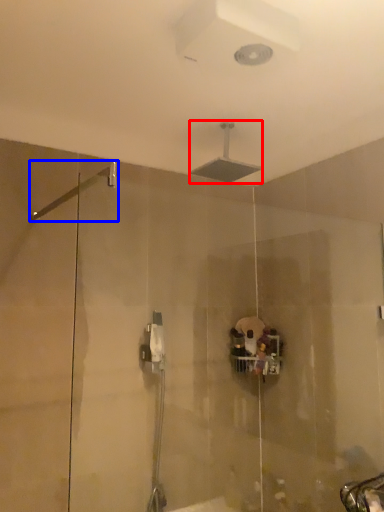
Question: Which object appears farthest to the camera in this image, shower (highlighted by a red box) or shower (highlighted by a blue box)?

Choices:
 (A) shower
 (B) shower

Answer: (A)